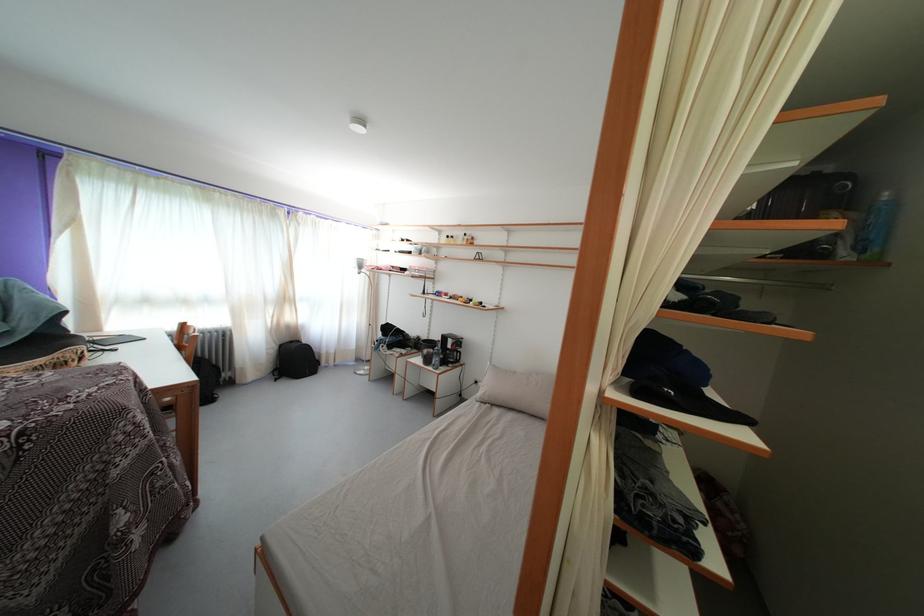
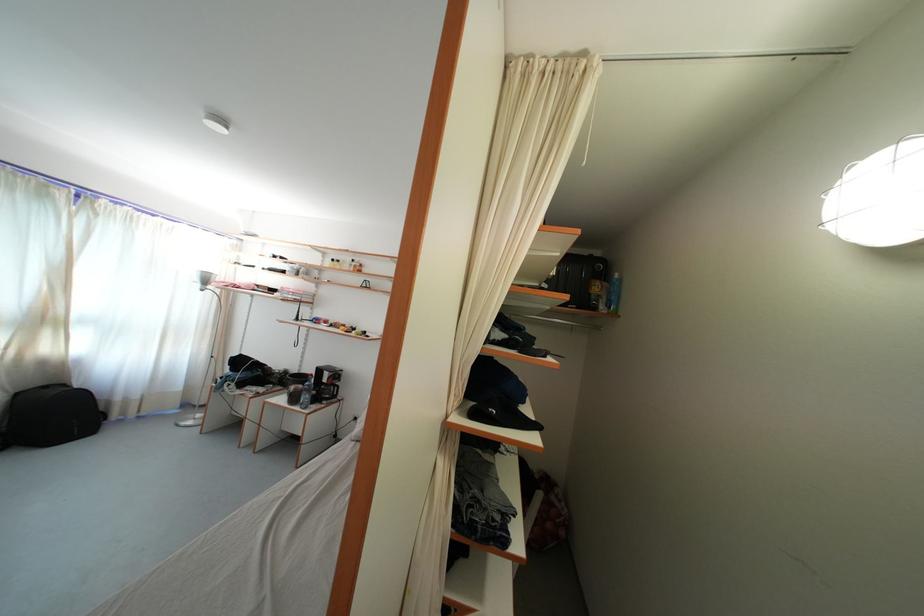
Find the pixel in the second image that matches pixel 433 367 in the first image.

(300, 405)